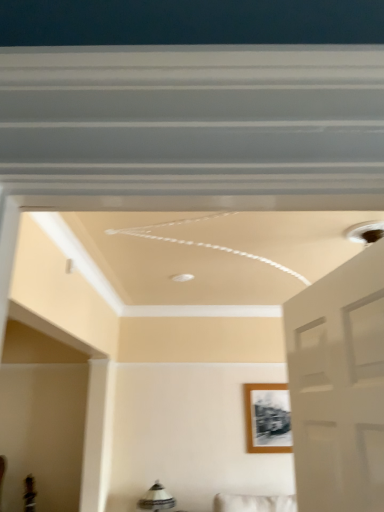
At what (x,y) coordinates should I click in order to perform the action: click on white glossy lampshade at lower center. Please return your answer as a coordinate pair (x, y). This screenshot has width=384, height=512. Looking at the image, I should click on (156, 499).

This screenshot has height=512, width=384. What do you see at coordinates (156, 499) in the screenshot? I see `white glossy lampshade at lower center` at bounding box center [156, 499].

Measure the distance between wooden photo frame at center and camera.

wooden photo frame at center is 12.65 feet away from camera.

Describe the element at coordinates (267, 418) in the screenshot. The image size is (384, 512). I see `wooden photo frame at center` at that location.

You are a GUI agent. You are given a task and a screenshot of the screen. Output one action in this format:
    pyautogui.click(x=<x>, y=<y>)
    Task: Click on the wooden photo frame at center
    
    Given the screenshot: What is the action you would take?
    pyautogui.click(x=267, y=418)

Image resolution: width=384 pixels, height=512 pixels. In order to click on white glossy lampshade at lower center in this screenshot , I will do `click(156, 499)`.

Which object is positioned more to the right, white glossy lampshade at lower center or wooden photo frame at center?

wooden photo frame at center.

Is white glossy lampshade at lower center positioned in front of wooden photo frame at center?

Yes.

Is point (144, 502) more distant than point (285, 435)?

No, (144, 502) is in front of (285, 435).

From the image's perspective, is white glossy lampshade at lower center beneath wooden photo frame at center?

Yes, from the image's perspective, white glossy lampshade at lower center is below wooden photo frame at center.

From a real-world perspective, is white glossy lampshade at lower center physically above wooden photo frame at center?

No, from a real-world perspective, white glossy lampshade at lower center is not on top of wooden photo frame at center.

Considering the relative sizes of white glossy lampshade at lower center and wooden photo frame at center in the image provided, is white glossy lampshade at lower center wider than wooden photo frame at center?

Yes.

Considering the sizes of white glossy lampshade at lower center and wooden photo frame at center in the image, is white glossy lampshade at lower center taller or shorter than wooden photo frame at center?

white glossy lampshade at lower center is shorter than wooden photo frame at center.

Can you confirm if white glossy lampshade at lower center is smaller than wooden photo frame at center?

Actually, white glossy lampshade at lower center might be larger than wooden photo frame at center.

Can we say white glossy lampshade at lower center lies outside wooden photo frame at center?

Indeed, white glossy lampshade at lower center is completely outside wooden photo frame at center.

Is the surface of white glossy lampshade at lower center in direct contact with wooden photo frame at center?

No, white glossy lampshade at lower center is not beside wooden photo frame at center.

Could you tell me if white glossy lampshade at lower center is turned towards wooden photo frame at center?

No, white glossy lampshade at lower center is not aimed at wooden photo frame at center.

How many degrees apart are the facing directions of white glossy lampshade at lower center and wooden photo frame at center?

The angle between the facing direction of white glossy lampshade at lower center and the facing direction of wooden photo frame at center is 1.46 degrees.

How far apart are white glossy lampshade at lower center and wooden photo frame at center?

They are 1.05 meters apart.

Where is `lamp below the wooden photo frame at center (from a real-world perspective)`? The width and height of the screenshot is (384, 512). lamp below the wooden photo frame at center (from a real-world perspective) is located at coordinates (156, 499).

Which is more to the right, wooden photo frame at center or white glossy lampshade at lower center?

wooden photo frame at center.

Which object is more forward, wooden photo frame at center or white glossy lampshade at lower center?

white glossy lampshade at lower center is closer to the camera.

Does point (253, 400) come closer to viewer compared to point (166, 504)?

No, (253, 400) is further to viewer.

From the image's perspective, is wooden photo frame at center located above white glossy lampshade at lower center?

Yes, from the image's perspective, wooden photo frame at center is above white glossy lampshade at lower center.

From a real-world perspective, is wooden photo frame at center physically located above or below white glossy lampshade at lower center?

wooden photo frame at center is situated higher than white glossy lampshade at lower center in the real world.

Is wooden photo frame at center thinner than white glossy lampshade at lower center?

Indeed, wooden photo frame at center has a lesser width compared to white glossy lampshade at lower center.

Which of these two, wooden photo frame at center or white glossy lampshade at lower center, stands taller?

wooden photo frame at center.

Is wooden photo frame at center smaller than white glossy lampshade at lower center?

Indeed, wooden photo frame at center has a smaller size compared to white glossy lampshade at lower center.

Is wooden photo frame at center situated inside white glossy lampshade at lower center or outside?

The correct answer is: outside.

Is wooden photo frame at center next to white glossy lampshade at lower center and touching it?

wooden photo frame at center is not next to white glossy lampshade at lower center, and they're not touching.

Is wooden photo frame at center oriented away from white glossy lampshade at lower center?

That's not correct — wooden photo frame at center is not looking away from white glossy lampshade at lower center.

Measure the distance from wooden photo frame at center to white glossy lampshade at lower center.

wooden photo frame at center is 3.46 feet away from white glossy lampshade at lower center.

Where is `lamp on the left of wooden photo frame at center`? The height and width of the screenshot is (512, 384). lamp on the left of wooden photo frame at center is located at coordinates (156, 499).

Locate an element on the screen. picture frame that appears behind the white glossy lampshade at lower center is located at coordinates (267, 418).

You are a GUI agent. You are given a task and a screenshot of the screen. Output one action in this format:
    pyautogui.click(x=<x>, y=<y>)
    Task: Click on the picture frame above the white glossy lampshade at lower center (from the image's perspective)
    This screenshot has width=384, height=512.
    Given the screenshot: What is the action you would take?
    click(x=267, y=418)